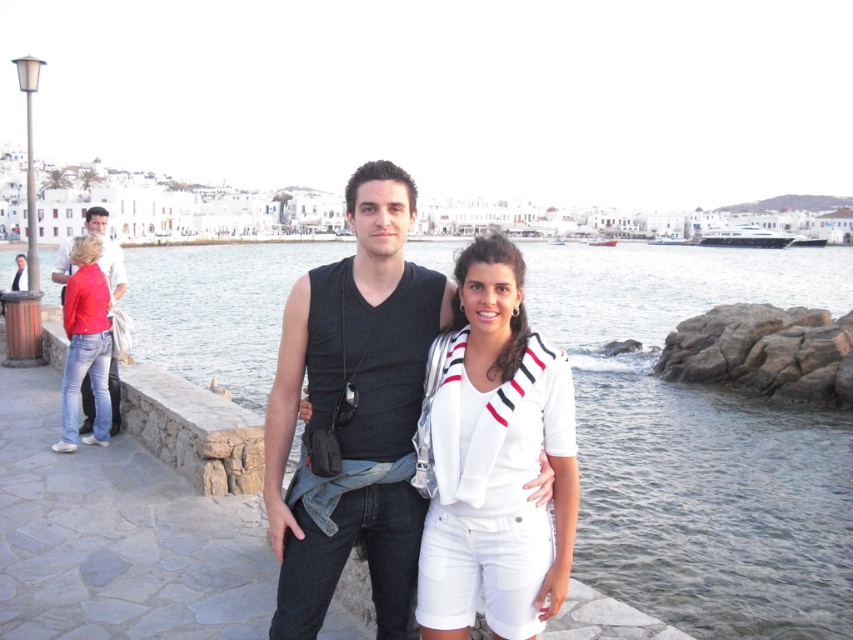
You are a photographer standing on the stone walkway. You want to capture a photo of the clear water at center and the white cotton shirt at center. Which object is wider in the scene?

The clear water at center is wider than the white cotton shirt at center according to the description.

You are standing at point (61, 252) and want to walk to the camera. Which direction should you move relative to point (747, 593)?

Since point (747, 593) is in front of point (61, 252), you should move towards point (747, 593) to reach the camera.